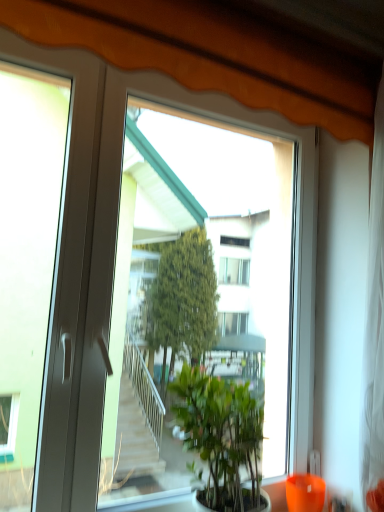
Question: Is transparent glass window at center outside of green leafy plant at center?

Choices:
 (A) yes
 (B) no

Answer: (A)

Question: Is transparent glass window at center directly adjacent to green leafy plant at center?

Choices:
 (A) no
 (B) yes

Answer: (A)

Question: Can you confirm if transparent glass window at center is taller than green leafy plant at center?

Choices:
 (A) no
 (B) yes

Answer: (B)

Question: Is the position of transparent glass window at center more distant than that of green leafy plant at center?

Choices:
 (A) no
 (B) yes

Answer: (A)

Question: From the image's perspective, is transparent glass window at center under green leafy plant at center?

Choices:
 (A) yes
 (B) no

Answer: (B)

Question: Considering the relative sizes of transparent glass window at center and green leafy plant at center in the image provided, is transparent glass window at center shorter than green leafy plant at center?

Choices:
 (A) no
 (B) yes

Answer: (A)

Question: Is green leafy plant at center positioned with its back to orange glass vase at lower right?

Choices:
 (A) yes
 (B) no

Answer: (B)

Question: From a real-world perspective, is green leafy plant at center physically below orange glass vase at lower right?

Choices:
 (A) no
 (B) yes

Answer: (A)

Question: Is green leafy plant at center oriented towards orange glass vase at lower right?

Choices:
 (A) no
 (B) yes

Answer: (A)

Question: Considering the relative positions of green leafy plant at center and orange glass vase at lower right in the image provided, is green leafy plant at center to the right of orange glass vase at lower right from the viewer's perspective?

Choices:
 (A) no
 (B) yes

Answer: (A)

Question: Considering the relative sizes of green leafy plant at center and orange glass vase at lower right in the image provided, is green leafy plant at center taller than orange glass vase at lower right?

Choices:
 (A) yes
 (B) no

Answer: (A)

Question: Can you confirm if green leafy plant at center is positioned to the left of orange glass vase at lower right?

Choices:
 (A) yes
 (B) no

Answer: (A)

Question: Is green leafy plant at center to the left of transparent glass window at center from the viewer's perspective?

Choices:
 (A) no
 (B) yes

Answer: (A)